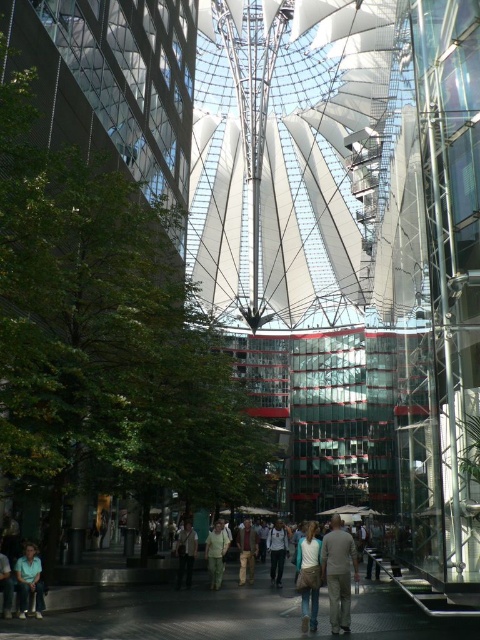
Between point (348, 582) and point (210, 586), which one is positioned behind?

Point (210, 586)

Is light brown fabric pants at lower right wider than light beige pants at center?

Yes, light brown fabric pants at lower right is wider than light beige pants at center.

Measure the distance between point (330, 548) and camera.

The distance of point (330, 548) from camera is 46.26 meters.

Where is `light brown fabric pants at lower right`? The height and width of the screenshot is (640, 480). light brown fabric pants at lower right is located at coordinates (338, 573).

Who is positioned more to the left, light brown fabric pants at lower right or light blue jeans at lower left?

light blue jeans at lower left

Is point (348, 570) positioned behind point (3, 611)?

Yes, point (348, 570) is behind point (3, 611).

Where is `light brown fabric pants at lower right`? light brown fabric pants at lower right is located at coordinates (338, 573).

Can you confirm if light blue shirt at center is positioned above brown leather jacket at center?

No.

Between point (272, 577) and point (251, 579), which one is positioned behind?

The point (272, 577) is behind.

Which is in front, point (279, 547) or point (249, 564)?

Point (249, 564) is in front.

Image resolution: width=480 pixels, height=640 pixels. I want to click on light blue shirt at center, so click(x=276, y=550).